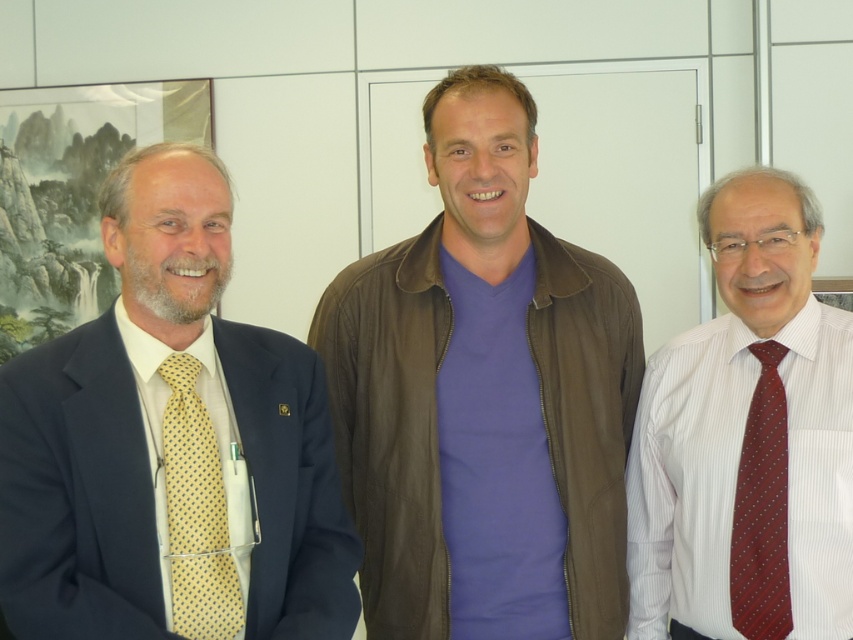
Question: Does matte yellow tie at left come in front of yellow dotted tie at left?

Choices:
 (A) yes
 (B) no

Answer: (A)

Question: Among these points, which one is farthest from the camera?

Choices:
 (A) (196, 432)
 (B) (404, 310)
 (C) (778, 509)

Answer: (B)

Question: Based on their relative distances, which object is nearer to the white striped shirt with red tie at right?

Choices:
 (A) maroon silk tie at right
 (B) matte yellow tie at left

Answer: (A)

Question: Does matte yellow tie at left appear on the right side of white striped shirt with red tie at right?

Choices:
 (A) yes
 (B) no

Answer: (B)

Question: Which point is farther to the camera?

Choices:
 (A) [x=160, y=282]
 (B) [x=183, y=512]
 (C) [x=486, y=589]
 (D) [x=782, y=420]

Answer: (D)

Question: Is white striped shirt with red tie at right behind maroon silk tie at right?

Choices:
 (A) no
 (B) yes

Answer: (A)